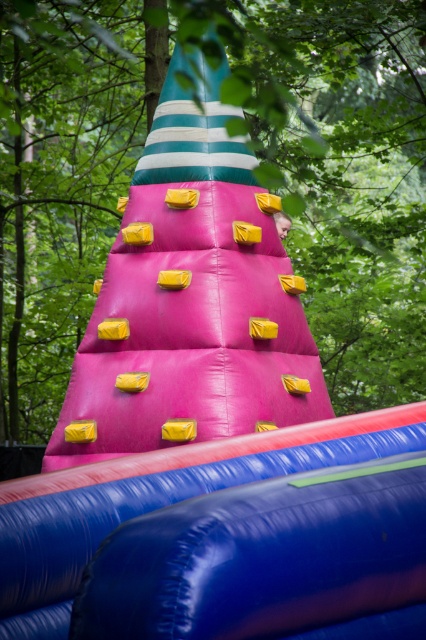
Based on the photo, you are a safety inspector evaluating the inflatable climbing structure. You notice the green matte tree at center and the smooth skin head at center. Which object has a greater width?

The green matte tree at center has a greater width than the smooth skin head at center.

You are a safety inspector checking the inflatable climbing structure. You notice the blue rubber slide at lower center and the smooth skin head at center. Which object is wider?

The blue rubber slide at lower center is wider than the smooth skin head at center according to the description.